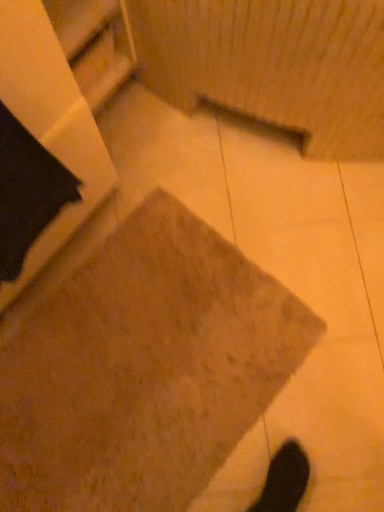
Question: Considering the positions of brown textured concrete at center and wooden shelf at upper left in the image, is brown textured concrete at center taller or shorter than wooden shelf at upper left?

Choices:
 (A) short
 (B) tall

Answer: (A)

Question: In the image, is brown textured concrete at center on the left side or the right side of wooden shelf at upper left?

Choices:
 (A) right
 (B) left

Answer: (A)

Question: Considering the positions of brown textured concrete at center and wooden shelf at upper left in the image, is brown textured concrete at center wider or thinner than wooden shelf at upper left?

Choices:
 (A) wide
 (B) thin

Answer: (A)

Question: Considering the relative positions of wooden shelf at upper left and brown textured concrete at center in the image provided, is wooden shelf at upper left to the left or to the right of brown textured concrete at center?

Choices:
 (A) left
 (B) right

Answer: (A)

Question: From a real-world perspective, is wooden shelf at upper left positioned above or below brown textured concrete at center?

Choices:
 (A) below
 (B) above

Answer: (B)

Question: Is wooden shelf at upper left taller or shorter than brown textured concrete at center?

Choices:
 (A) short
 (B) tall

Answer: (B)

Question: Is point (109, 50) closer or farther from the camera than point (218, 361)?

Choices:
 (A) closer
 (B) farther

Answer: (B)